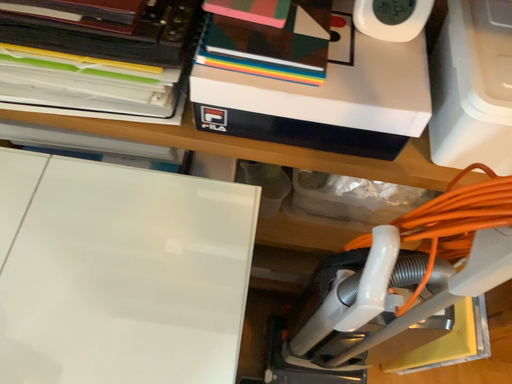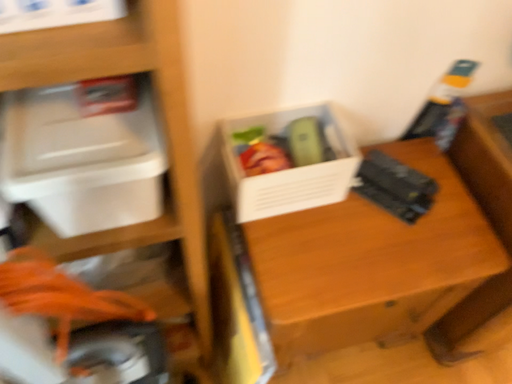
Question: Which way did the camera rotate in the video?

Choices:
 (A) rotated right
 (B) rotated left

Answer: (A)